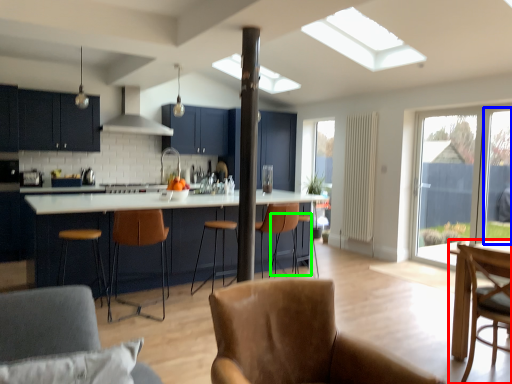
Question: Which object is the closest to the chair (highlighted by a red box)? Choose among these: window screen (highlighted by a blue box) or bar stool (highlighted by a green box).

Choices:
 (A) window screen
 (B) bar stool

Answer: (B)